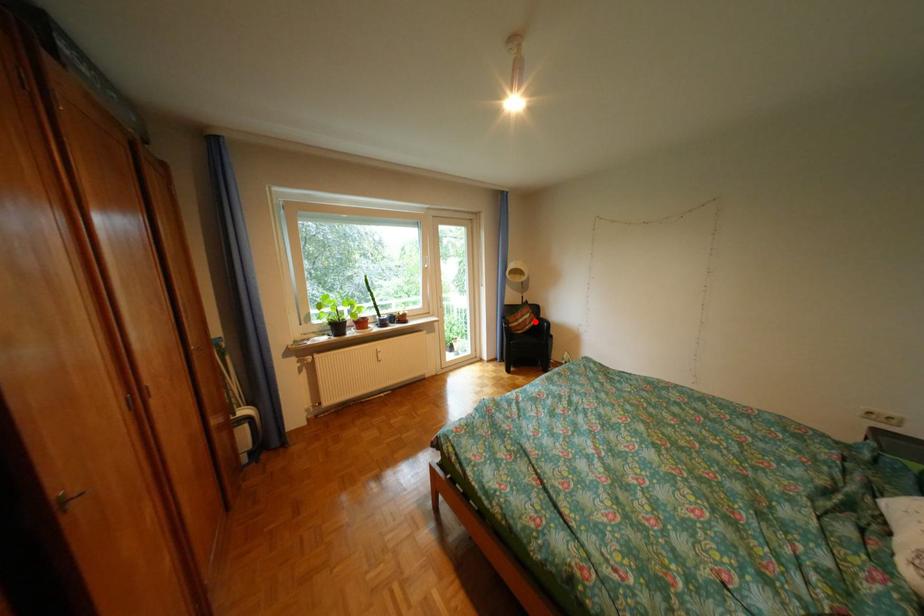
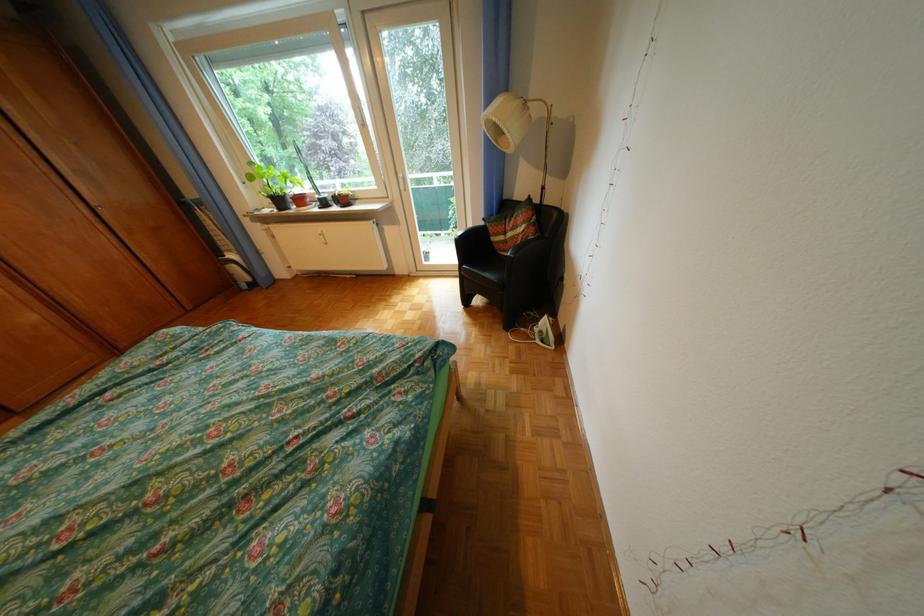
Question: I am providing you with two images of the same scene from different viewpoints. Image1 has a red point marked. In image2, the corresponding 3D location appears at what relative position? Reply with the corresponding letter.

Choices:
 (A) Closer
 (B) Farther

Answer: (A)